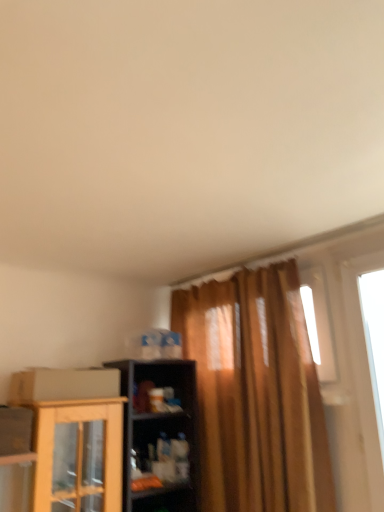
Question: Should I look upward or downward to see cardboard box at lower left?

Choices:
 (A) down
 (B) up

Answer: (A)

Question: Is cardboard box at lower left not inside transparent glass window at right?

Choices:
 (A) yes
 (B) no

Answer: (A)

Question: Can you confirm if cardboard box at lower left is thinner than transparent glass window at right?

Choices:
 (A) no
 (B) yes

Answer: (A)

Question: From a real-world perspective, is cardboard box at lower left physically above transparent glass window at right?

Choices:
 (A) no
 (B) yes

Answer: (A)

Question: Can you confirm if cardboard box at lower left is positioned to the right of transparent glass window at right?

Choices:
 (A) yes
 (B) no

Answer: (B)

Question: Is cardboard box at lower left positioned in front of transparent glass window at right?

Choices:
 (A) yes
 (B) no

Answer: (B)

Question: Is cardboard box at lower left touching transparent glass window at right?

Choices:
 (A) no
 (B) yes

Answer: (A)

Question: Is transparent glass window at right located outside cardboard box at lower left?

Choices:
 (A) no
 (B) yes

Answer: (B)

Question: Would you consider transparent glass window at right to be distant from cardboard box at lower left?

Choices:
 (A) yes
 (B) no

Answer: (A)

Question: Can you confirm if transparent glass window at right is thinner than cardboard box at lower left?

Choices:
 (A) yes
 (B) no

Answer: (A)

Question: Would you say cardboard box at lower left is part of transparent glass window at right's contents?

Choices:
 (A) no
 (B) yes

Answer: (A)

Question: From the image's perspective, is transparent glass window at right below cardboard box at lower left?

Choices:
 (A) yes
 (B) no

Answer: (B)

Question: Does transparent glass window at right have a greater height compared to cardboard box at lower left?

Choices:
 (A) yes
 (B) no

Answer: (A)

Question: From the image's perspective, would you say cardboard box at lower left is positioned over matte plastic shelf at center?

Choices:
 (A) no
 (B) yes

Answer: (B)